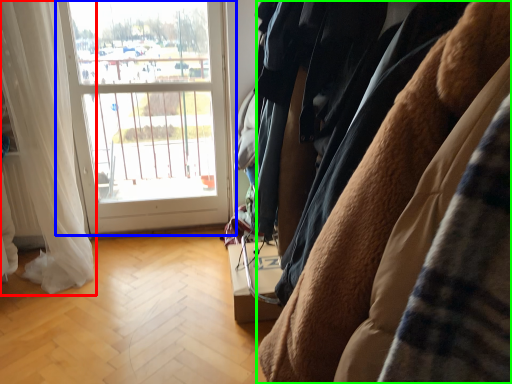
Question: Considering the real-world distances, which object is farthest from curtain (highlighted by a red box)? window (highlighted by a blue box) or furniture (highlighted by a green box)?

Choices:
 (A) window
 (B) furniture

Answer: (B)